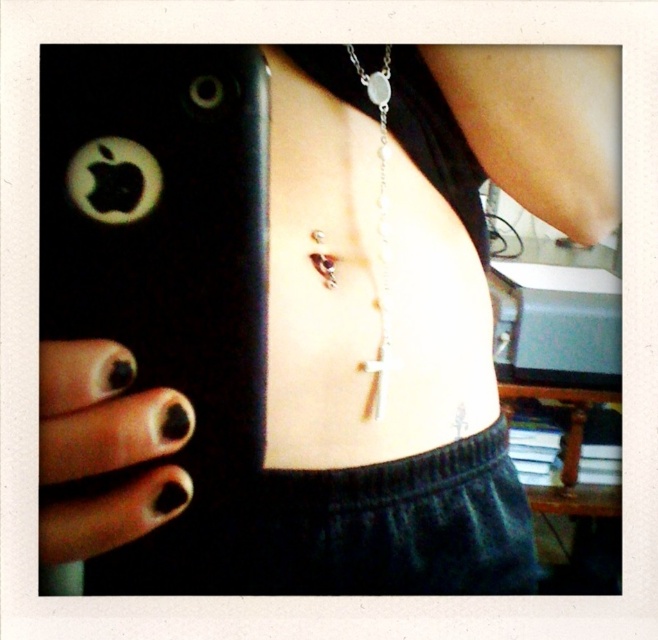
From the picture: Does black matte nails at lower left have a greater height compared to silver metallic chain at center?

No.

Does black matte nails at lower left appear under silver metallic chain at center?

Yes.

The image size is (658, 640). What do you see at coordinates (101, 412) in the screenshot?
I see `black matte nails at lower left` at bounding box center [101, 412].

You are a GUI agent. You are given a task and a screenshot of the screen. Output one action in this format:
    pyautogui.click(x=<x>, y=<y>)
    Task: Click on the black matte nails at lower left
    
    Given the screenshot: What is the action you would take?
    pyautogui.click(x=101, y=412)